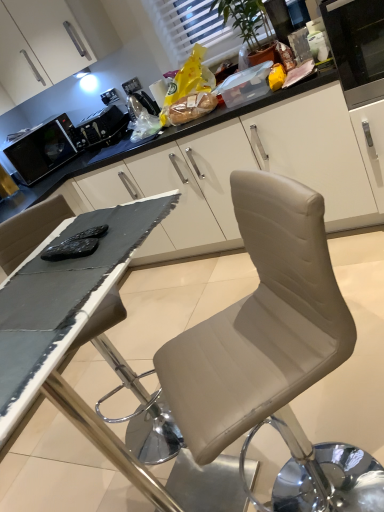
Measure the distance between black matte microwave at left, the second appliance when ordered from right to left, and camera.

black matte microwave at left, the second appliance when ordered from right to left, and camera are 9.55 feet apart from each other.

I want to click on white textured window at upper center, so click(192, 30).

What is the approximate height of beige leather chair at center?

1.61 inches.

Where is `beige leather chair at center`? This screenshot has height=512, width=384. beige leather chair at center is located at coordinates tap(273, 354).

This screenshot has width=384, height=512. What do you see at coordinates (101, 127) in the screenshot? I see `satin black toaster at upper center, the 2th appliance viewed from the left` at bounding box center [101, 127].

Locate an element on the screen. black matte table at center is located at coordinates (66, 382).

Considering the relative sizes of satin black toaster at upper center, the 2th appliance viewed from the left, and white textured window at upper center in the image provided, is satin black toaster at upper center, the 2th appliance viewed from the left, wider than white textured window at upper center?

Yes.

Which of these two, satin black toaster at upper center, the 1th appliance from the right, or white textured window at upper center, stands taller?

white textured window at upper center is taller.

Between satin black toaster at upper center, the 1th appliance from the right, and white textured window at upper center, which one has smaller size?

With smaller size is satin black toaster at upper center, the 1th appliance from the right.

From the image's perspective, relative to white textured window at upper center, is satin black toaster at upper center, the 1th appliance from the right, above or below?

satin black toaster at upper center, the 1th appliance from the right, is below white textured window at upper center.

Consider the image. Between white textured window at upper center and satin black toaster at upper center, the 1th appliance from the right, which one has smaller width?

white textured window at upper center is thinner.

From a real-world perspective, is white textured window at upper center physically located above or below satin black toaster at upper center, the 1th appliance from the right?

white textured window at upper center is above satin black toaster at upper center, the 1th appliance from the right.

In the scene shown: Between white textured window at upper center and satin black toaster at upper center, the 1th appliance from the right, which one has larger size?

white textured window at upper center is bigger.

Would you say white textured window at upper center is outside black matte microwave at left, the second appliance when ordered from right to left?

Yes, white textured window at upper center is located beyond the bounds of black matte microwave at left, the second appliance when ordered from right to left.

In the scene shown: Is white textured window at upper center looking in the opposite direction of black matte microwave at left, which is the 1th appliance in left-to-right order?

That's not correct — white textured window at upper center is not looking away from black matte microwave at left, which is the 1th appliance in left-to-right order.

Does white textured window at upper center have a smaller size compared to black matte microwave at left, which is the 1th appliance in left-to-right order?

Yes, white textured window at upper center is smaller than black matte microwave at left, which is the 1th appliance in left-to-right order.

Is black matte microwave at left, the second appliance when ordered from right to left, spatially inside satin black toaster at upper center, the 1th appliance from the right, or outside of it?

black matte microwave at left, the second appliance when ordered from right to left, is spatially situated outside satin black toaster at upper center, the 1th appliance from the right.

Does black matte microwave at left, the second appliance when ordered from right to left, turn towards satin black toaster at upper center, the 1th appliance from the right?

No, black matte microwave at left, the second appliance when ordered from right to left, does not turn towards satin black toaster at upper center, the 1th appliance from the right.

Who is smaller, black matte microwave at left, the second appliance when ordered from right to left, or satin black toaster at upper center, the 2th appliance viewed from the left?

satin black toaster at upper center, the 2th appliance viewed from the left, is smaller.

Does black matte microwave at left, the second appliance when ordered from right to left, have a lesser height compared to satin black toaster at upper center, the 1th appliance from the right?

In fact, black matte microwave at left, the second appliance when ordered from right to left, may be taller than satin black toaster at upper center, the 1th appliance from the right.

Is black matte microwave at left, the second appliance when ordered from right to left, completely or partially outside of white textured window at upper center?

black matte microwave at left, the second appliance when ordered from right to left, lies outside white textured window at upper center's area.

Between black matte microwave at left, which is the 1th appliance in left-to-right order, and white textured window at upper center, which one appears on the right side from the viewer's perspective?

white textured window at upper center.

From the image's perspective, between black matte microwave at left, the second appliance when ordered from right to left, and white textured window at upper center, who is located below?

black matte microwave at left, the second appliance when ordered from right to left, appears lower in the image.

Can you confirm if black matte microwave at left, the second appliance when ordered from right to left, is thinner than white textured window at upper center?

In fact, black matte microwave at left, the second appliance when ordered from right to left, might be wider than white textured window at upper center.

Which of these two, beige leather chair at center or satin black toaster at upper center, the 1th appliance from the right, stands shorter?

beige leather chair at center is shorter.

Is beige leather chair at center situated inside satin black toaster at upper center, the 1th appliance from the right, or outside?

The correct answer is: outside.

Is the surface of beige leather chair at center in direct contact with satin black toaster at upper center, the 1th appliance from the right?

No, beige leather chair at center is not making contact with satin black toaster at upper center, the 1th appliance from the right.

Find the location of a particular element. The width and height of the screenshot is (384, 512). chair below the black matte microwave at left, which is the 1th appliance in left-to-right order (from the image's perspective) is located at coordinates (273, 354).

Based on their positions, is black matte microwave at left, the second appliance when ordered from right to left, located to the left or right of beige leather chair at center?

black matte microwave at left, the second appliance when ordered from right to left, is positioned on beige leather chair at center's left side.

Between black matte microwave at left, which is the 1th appliance in left-to-right order, and beige leather chair at center, which one is positioned in front?

Positioned in front is beige leather chair at center.

Would you say beige leather chair at center is part of black matte microwave at left, the second appliance when ordered from right to left,'s contents?

No, black matte microwave at left, the second appliance when ordered from right to left, does not contain beige leather chair at center.

Image resolution: width=384 pixels, height=512 pixels. What are the coordinates of `window above the satin black toaster at upper center, the 1th appliance from the right (from a real-world perspective)` in the screenshot? It's located at (192, 30).

Identify the location of window on the right of satin black toaster at upper center, the 1th appliance from the right. This screenshot has width=384, height=512. (192, 30).

Based on the photo, looking at the image, which one is located further to satin black toaster at upper center, the 2th appliance viewed from the left, black matte table at center or matte plastic bag of bread at upper center?

Among the two, black matte table at center is located further to satin black toaster at upper center, the 2th appliance viewed from the left.

Consider the image. From the image, which object appears to be nearer to white textured window at upper center, beige leather chair at center or black matte microwave at left, which is the 1th appliance in left-to-right order?

black matte microwave at left, which is the 1th appliance in left-to-right order, is positioned closer to the anchor white textured window at upper center.

Consider the image. Looking at the image, which one is located closer to white textured window at upper center, matte plastic bag of bread at upper center or black matte microwave at left, the second appliance when ordered from right to left?

matte plastic bag of bread at upper center lies closer to white textured window at upper center than the other object.

Which object lies nearer to the anchor point white textured window at upper center, matte plastic bag of bread at upper center or black matte table at center?

matte plastic bag of bread at upper center.

From the image, which object appears to be farther from beige leather chair at center, black matte microwave at left, which is the 1th appliance in left-to-right order, or matte plastic bag of bread at upper center?

The object further to beige leather chair at center is black matte microwave at left, which is the 1th appliance in left-to-right order.

Estimate the real-world distances between objects in this image. Which object is further from black matte microwave at left, the second appliance when ordered from right to left, white textured window at upper center or black matte table at center?

The object further to black matte microwave at left, the second appliance when ordered from right to left, is black matte table at center.

Consider the image. From the image, which object appears to be farther from beige leather chair at center, white textured window at upper center or black matte microwave at left, which is the 1th appliance in left-to-right order?

black matte microwave at left, which is the 1th appliance in left-to-right order.

From the image, which object appears to be farther from satin black toaster at upper center, the 1th appliance from the right, white textured window at upper center or matte plastic bag of bread at upper center?

white textured window at upper center.

Where is `food located between beige leather chair at center and satin black toaster at upper center, the 1th appliance from the right, in the depth direction`? food located between beige leather chair at center and satin black toaster at upper center, the 1th appliance from the right, in the depth direction is located at coordinates (188, 108).

Locate an element on the screen. The width and height of the screenshot is (384, 512). chair between black matte table at center and matte plastic bag of bread at upper center along the z-axis is located at coordinates (273, 354).

Identify the location of window between black matte table at center and satin black toaster at upper center, the 2th appliance viewed from the left, in the front-back direction. Image resolution: width=384 pixels, height=512 pixels. pyautogui.click(x=192, y=30).

Locate an element on the screen. The width and height of the screenshot is (384, 512). appliance between black matte table at center and black matte microwave at left, which is the 1th appliance in left-to-right order, along the z-axis is located at coordinates (101, 127).